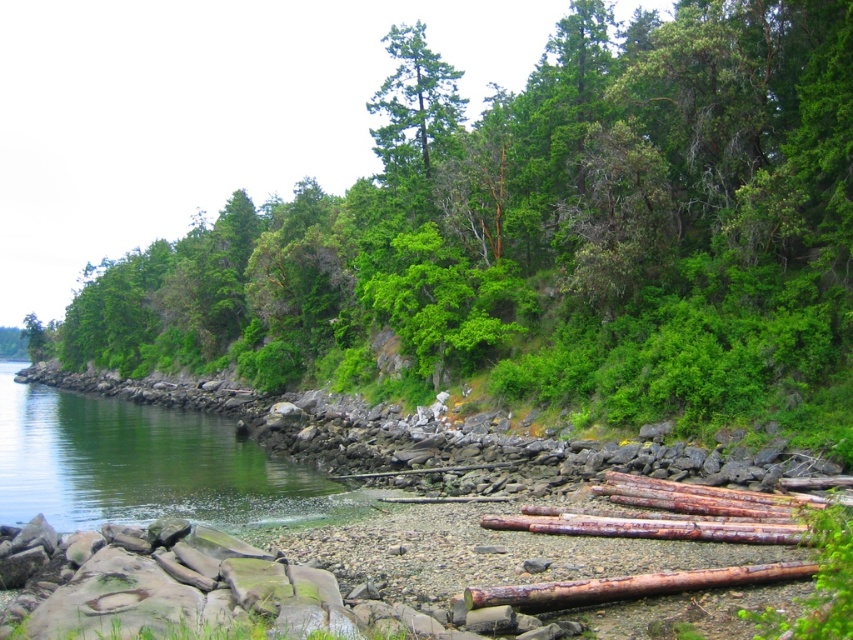
You are a kayaker planning to paddle from the green smooth water at lower left to the rusty wood log at lower right. Given that your kayak is 12 feet long, will you have enough space to maneuver between them?

The green smooth water at lower left is 108.22 feet away from the rusty wood log at lower right. Since your kayak is only 12 feet long, there is more than enough space to maneuver between them comfortably.

You are a park ranger planning to install a trail between the green leafy tree at center and the rusty wood log at lower right. The trail must be at least 70 meters long to accommodate safety features. Can the trail be built as planned?

The distance between the green leafy tree at center and the rusty wood log at lower right is 75.29 meters, which exceeds the required 70 meters. Therefore, the trail can be built as planned.

You are standing on the rocky beach and want to take a photo that includes both the green smooth water at lower left and the green matte tree at upper center. Which object will occupy a smaller portion of the photo?

The green smooth water at lower left occupies less space than the green matte tree at upper center, so it will occupy a smaller portion of the photo.